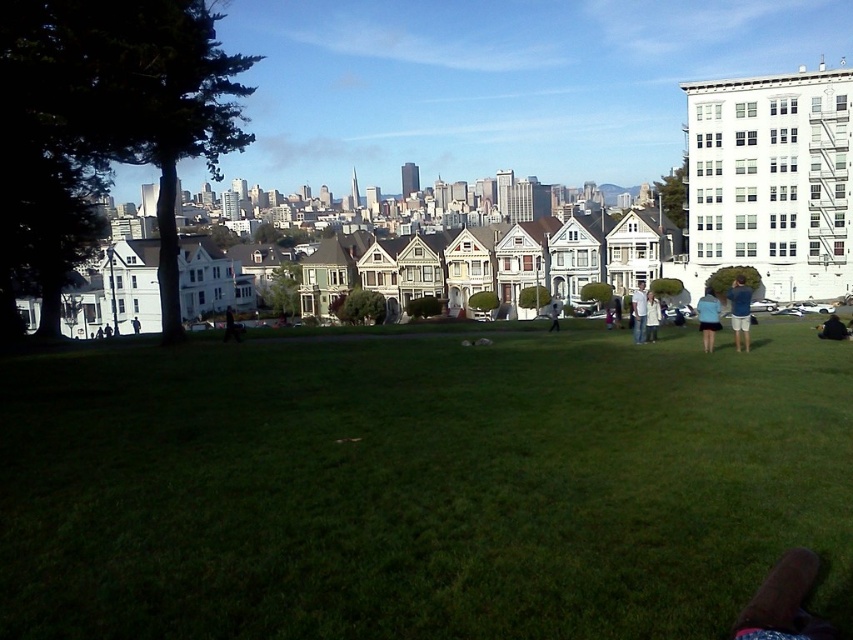
Question: Can you confirm if blue fabric shorts at lower right is positioned to the left of white matte jacket at center?

Choices:
 (A) no
 (B) yes

Answer: (A)

Question: Among these points, which one is nearest to the camera?

Choices:
 (A) (704, 332)
 (B) (759, 572)
 (C) (635, 339)
 (D) (558, 317)

Answer: (B)

Question: Is blue fabric shorts at center-right positioned behind black fabric at lower right?

Choices:
 (A) yes
 (B) no

Answer: (B)

Question: Which of the following is the farthest from the observer?

Choices:
 (A) light blue shirt at center
 (B) light blue jeans at center
 (C) white matte jacket at center

Answer: (B)

Question: Which of the following is the closest to the observer?

Choices:
 (A) light blue shirt at center
 (B) blue fabric shorts at lower right
 (C) green grass at center
 (D) white matte jacket at center

Answer: (C)

Question: Where is light blue shirt at center located in relation to black fabric at lower right in the image?

Choices:
 (A) above
 (B) below

Answer: (A)